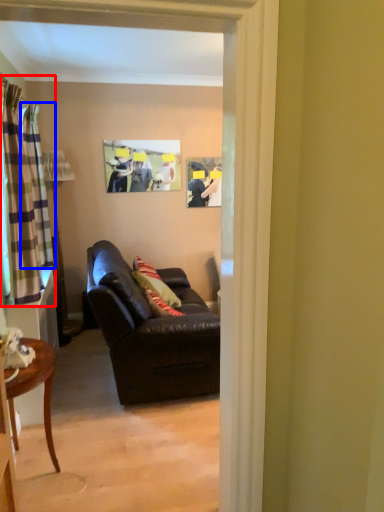
Question: Which object is closer to the camera taking this photo, curtain (highlighted by a red box) or curtain (highlighted by a blue box)?

Choices:
 (A) curtain
 (B) curtain

Answer: (A)